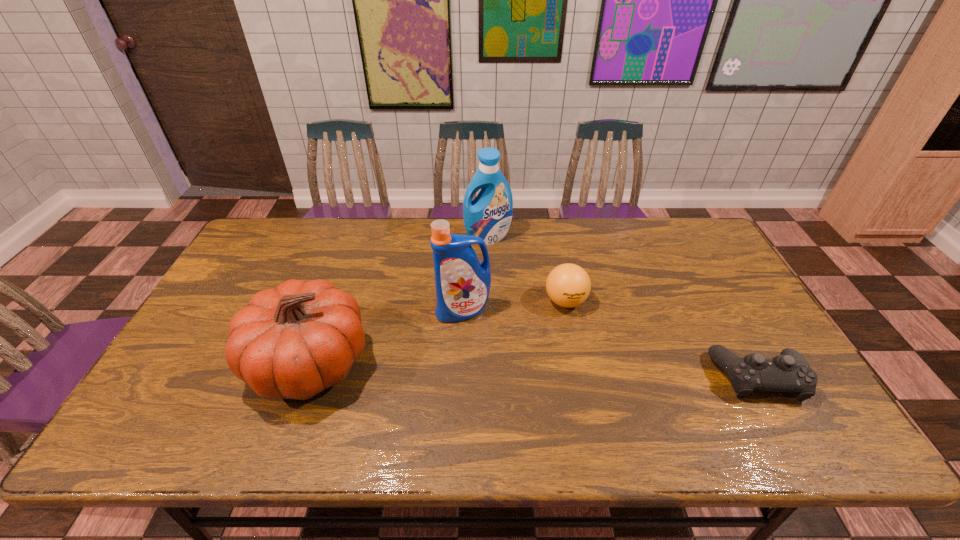
The width and height of the screenshot is (960, 540). Find the location of `free space located 0.060m on the face of the third shortest object`. free space located 0.060m on the face of the third shortest object is located at coordinates (225, 363).

The width and height of the screenshot is (960, 540). In order to click on vacant space situated 0.070m on the left of the shortest object in this screenshot , I will do `click(685, 377)`.

This screenshot has height=540, width=960. What are the coordinates of `free location located on the front-facing side of the farther detergent` in the screenshot? It's located at [516, 316].

You are a GUI agent. You are given a task and a screenshot of the screen. Output one action in this format:
    pyautogui.click(x=<x>, y=<y>)
    Task: Click on the vacant point located on the front-facing side of the farther detergent
    
    Given the screenshot: What is the action you would take?
    pyautogui.click(x=508, y=291)

You are a GUI agent. You are given a task and a screenshot of the screen. Output one action in this format:
    pyautogui.click(x=<x>, y=<y>)
    Task: Click on the vacant space located on the front-facing side of the farther detergent
    The height and width of the screenshot is (540, 960).
    Given the screenshot: What is the action you would take?
    pyautogui.click(x=516, y=312)

This screenshot has width=960, height=540. Find the location of `free space located 0.250m on the side with brand of the second object from right to left`. free space located 0.250m on the side with brand of the second object from right to left is located at coordinates (556, 390).

Where is `blank area located on the side with brand of the second object from right to left`? The image size is (960, 540). blank area located on the side with brand of the second object from right to left is located at coordinates (563, 329).

In order to click on vacant region located 0.110m on the side with brand of the second object from right to left in this screenshot , I will do `click(561, 346)`.

At what (x,y) coordinates should I click in order to perform the action: click on vacant space located 0.110m on the label of the nearer detergent. Please return your answer as a coordinate pair (x, y). The image size is (960, 540). Looking at the image, I should click on (469, 355).

This screenshot has width=960, height=540. I want to click on free spot located on the label of the nearer detergent, so point(472,374).